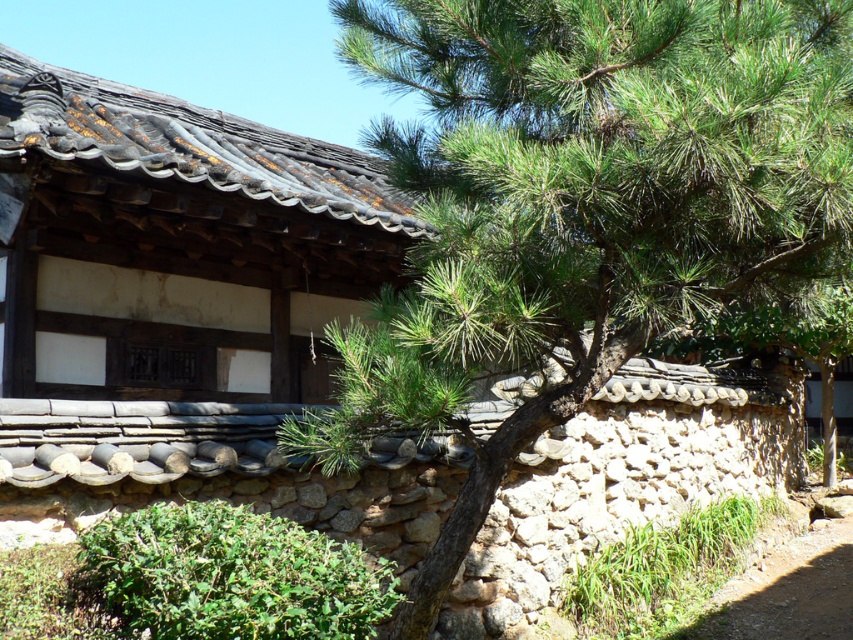
Question: Among these objects, which one is farthest from the camera?

Choices:
 (A) dirt path at lower right
 (B) green needle-like leaves at center

Answer: (A)

Question: Which point is closer to the camera?

Choices:
 (A) (780, 556)
 (B) (822, 51)

Answer: (B)

Question: Is green needle-like leaves at center positioned behind dirt path at lower right?

Choices:
 (A) no
 (B) yes

Answer: (A)

Question: Is green needle-like leaves at center below dirt path at lower right?

Choices:
 (A) no
 (B) yes

Answer: (A)

Question: Does green needle-like leaves at center have a lesser width compared to dirt path at lower right?

Choices:
 (A) yes
 (B) no

Answer: (B)

Question: Which object appears closest to the camera in this image?

Choices:
 (A) dirt path at lower right
 (B) green needle-like leaves at center

Answer: (B)